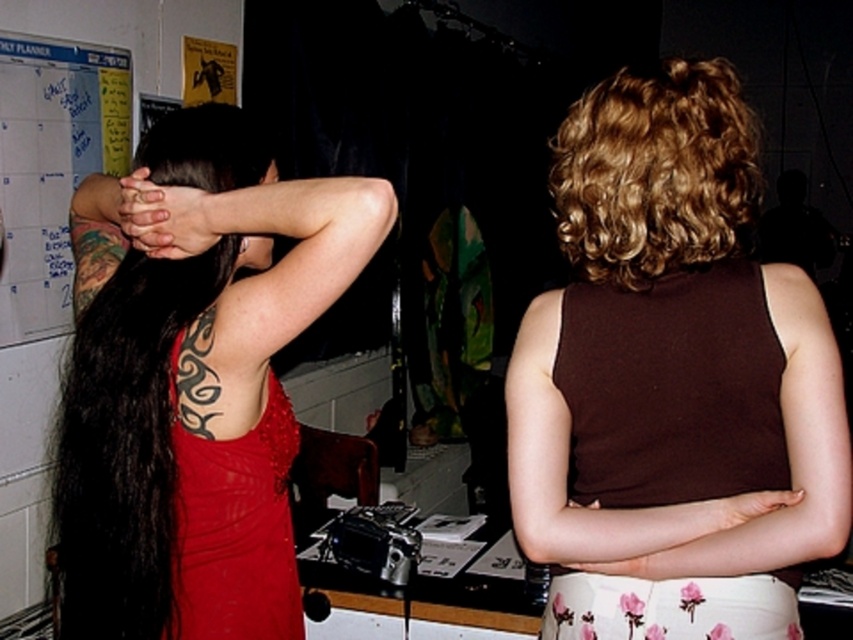
From the picture: You are standing in the room and want to touch the point at coordinates (207, 148). Which person should you approach to reach that point?

The point at coordinates (207, 148) is on the matte black hair at upper left, so you should approach the person on the left to reach that point.

You are a photographer adjusting your camera settings. You notice two points in the image at coordinates point (682, 256) and point (193, 163). Which point is nearer to your camera lens?

Point (682, 256) is closer to the camera than point (193, 163).

Looking at the scene, which object is positioned to the left of the other between the matte black hair at upper left and the matte black hands at upper left?

The matte black hair at upper left is positioned to the left of the matte black hands at upper left.